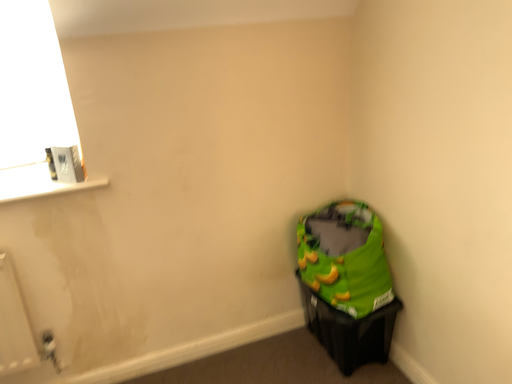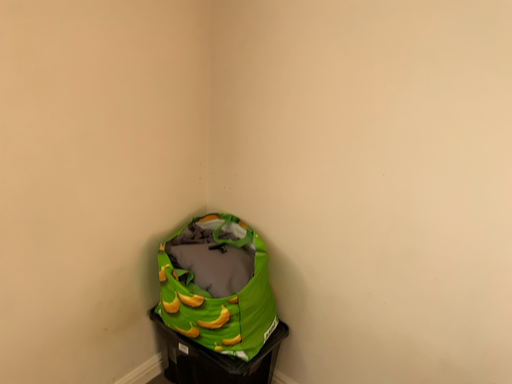
Question: Which way did the camera rotate in the video?

Choices:
 (A) rotated left
 (B) rotated right

Answer: (B)